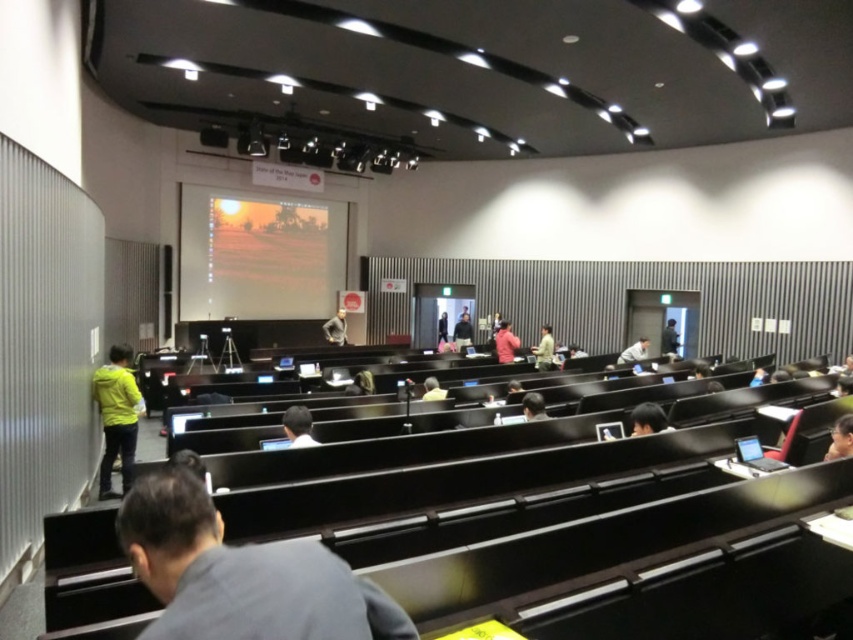
Question: Is light brown fabric shirt at center closer to the viewer compared to green fabric jacket at center?

Choices:
 (A) yes
 (B) no

Answer: (B)

Question: Can you confirm if matte orange screen at center is bigger than light brown fabric shirt at center?

Choices:
 (A) yes
 (B) no

Answer: (A)

Question: Based on their relative distances, which object is nearer to the matte orange screen at center?

Choices:
 (A) yellow fabric jacket at left
 (B) dark brown hair at center
 (C) light blue shirt at center

Answer: (C)

Question: Does matte orange screen at center have a smaller size compared to dark gray shirt at center?

Choices:
 (A) yes
 (B) no

Answer: (B)

Question: Which of the following is the farthest from the observer?

Choices:
 (A) (848, 419)
 (B) (315, 440)
 (C) (500, 344)
 (D) (527, 413)

Answer: (C)

Question: Which object is positioned farthest from the smooth beige statue at center?

Choices:
 (A) light brown leather jacket at center
 (B) dark gray fabric jacket at center

Answer: (B)